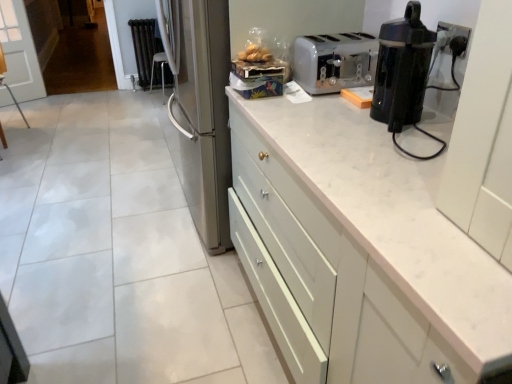
Identify the location of black metallic radiator at upper left. This screenshot has width=512, height=384. (149, 54).

At what (x,y) coordinates should I click in order to perform the action: click on translucent plastic bag of bread at upper center. Please return your answer as a coordinate pair (x, y). The image size is (512, 384). Looking at the image, I should click on (255, 54).

What is the approximate width of white matte cabinet at upper right?

white matte cabinet at upper right is 25.73 inches in width.

Identify the location of black plastic coffee maker at upper right. (402, 69).

Measure the distance between point (360,59) and camera.

Point (360,59) is 1.88 meters away from camera.

Measure the distance between black plastic electric outlet at upper right and camera.

1.26 meters.

In order to face black plastic electric outlet at upper right, should I rotate leftwards or rightwards?

Rotate right and turn 24.347 degrees.

Where is `black metallic radiator at upper left`? The width and height of the screenshot is (512, 384). black metallic radiator at upper left is located at coordinates (149, 54).

Who is shorter, black plastic coffee maker at upper right or white matte cabinet at upper right?

Standing shorter between the two is black plastic coffee maker at upper right.

Is point (410, 75) positioned behind point (484, 298)?

Yes, it is.

How distant is black plastic coffee maker at upper right from white matte cabinet at upper right?

10.03 inches.

Based on their sizes in the image, would you say black plastic coffee maker at upper right is bigger or smaller than white matte cabinet at upper right?

Clearly, black plastic coffee maker at upper right is smaller in size than white matte cabinet at upper right.

Is translucent plastic bag of bread at upper center looking in the opposite direction of black metallic radiator at upper left?

No, black metallic radiator at upper left is not at the back of translucent plastic bag of bread at upper center.

Would you say translucent plastic bag of bread at upper center contains black metallic radiator at upper left?

No, black metallic radiator at upper left is not surrounded by translucent plastic bag of bread at upper center.

In the scene shown: From the image's perspective, is translucent plastic bag of bread at upper center below black metallic radiator at upper left?

Indeed, from the image's perspective, translucent plastic bag of bread at upper center is shown beneath black metallic radiator at upper left.

From a real-world perspective, is translucent plastic bag of bread at upper center above or below black metallic radiator at upper left?

translucent plastic bag of bread at upper center is above black metallic radiator at upper left.

From a real-world perspective, which object stands above the other?

black plastic electric outlet at upper right.

Is white matte cabinet at upper right at the right side of black plastic electric outlet at upper right?

No.

Considering their positions, is white matte cabinet at upper right located in front of or behind black plastic electric outlet at upper right?

In the image, white matte cabinet at upper right appears in front of black plastic electric outlet at upper right.

Who is smaller, white matte cabinet at upper right or black plastic electric outlet at upper right?

black plastic electric outlet at upper right.

Is point (133, 26) closer or farther from the camera than point (449, 39)?

Point (133, 26) is positioned farther from the camera compared to point (449, 39).

Between black metallic radiator at upper left and black plastic electric outlet at upper right, which one has larger width?

With larger width is black metallic radiator at upper left.

Does black metallic radiator at upper left have a greater height compared to black plastic electric outlet at upper right?

Correct, black metallic radiator at upper left is much taller as black plastic electric outlet at upper right.

Is black metallic radiator at upper left oriented towards black plastic electric outlet at upper right?

Yes, black metallic radiator at upper left is aimed at black plastic electric outlet at upper right.

You are a GUI agent. You are given a task and a screenshot of the screen. Output one action in this format:
    pyautogui.click(x=<x>, y=<y>)
    Task: Click on the electric outlet below the translucent plastic bag of bread at upper center (from the image's perspective)
    
    Given the screenshot: What is the action you would take?
    pyautogui.click(x=454, y=30)

Which object is positioned more to the left, black plastic electric outlet at upper right or translucent plastic bag of bread at upper center?

From the viewer's perspective, translucent plastic bag of bread at upper center appears more on the left side.

Could you tell me if black plastic electric outlet at upper right is facing translucent plastic bag of bread at upper center?

No, black plastic electric outlet at upper right does not turn towards translucent plastic bag of bread at upper center.

Considering the sizes of objects black plastic electric outlet at upper right and translucent plastic bag of bread at upper center in the image provided, who is thinner, black plastic electric outlet at upper right or translucent plastic bag of bread at upper center?

With smaller width is black plastic electric outlet at upper right.

Is black plastic electric outlet at upper right at the right side of black plastic coffee maker at upper right?

Yes.

Can we say black plastic electric outlet at upper right lies outside black plastic coffee maker at upper right?

Yes, black plastic electric outlet at upper right is not within black plastic coffee maker at upper right.

Is black plastic electric outlet at upper right wider or thinner than black plastic coffee maker at upper right?

Clearly, black plastic electric outlet at upper right has less width compared to black plastic coffee maker at upper right.

Could you tell me if black plastic coffee maker at upper right is turned towards white plastic toaster at upper right?

No, black plastic coffee maker at upper right does not turn towards white plastic toaster at upper right.

From the image's perspective, is black plastic coffee maker at upper right above white plastic toaster at upper right?

No, from the image's perspective, black plastic coffee maker at upper right is not on top of white plastic toaster at upper right.

Which object is further away from the camera, black plastic coffee maker at upper right or white plastic toaster at upper right?

white plastic toaster at upper right is behind.

Is black plastic coffee maker at upper right far away from white plastic toaster at upper right?

No, there isn't a large distance between black plastic coffee maker at upper right and white plastic toaster at upper right.

The width and height of the screenshot is (512, 384). In the image, there is a black plastic coffee maker at upper right. Identify the location of cabinetry below it (from the image's perspective). (393, 218).

This screenshot has height=384, width=512. What are the coordinates of `radiator on the left of translucent plastic bag of bread at upper center` in the screenshot? It's located at (149, 54).

Consider the image. Which object lies further to the anchor point translucent plastic bag of bread at upper center, white matte cabinet at upper right or black plastic electric outlet at upper right?

white matte cabinet at upper right.

Estimate the real-world distances between objects in this image. Which object is further from translucent plastic bag of bread at upper center, black plastic electric outlet at upper right or white matte cabinet at upper right?

The object further to translucent plastic bag of bread at upper center is white matte cabinet at upper right.

When comparing their distances from translucent plastic bag of bread at upper center, does black metallic radiator at upper left or black plastic electric outlet at upper right seem closer?

Based on the image, black plastic electric outlet at upper right appears to be nearer to translucent plastic bag of bread at upper center.

From the image, which object appears to be nearer to white matte cabinet at upper right, white plastic toaster at upper right or translucent plastic bag of bread at upper center?

white plastic toaster at upper right is closer to white matte cabinet at upper right.

Estimate the real-world distances between objects in this image. Which object is closer to black metallic radiator at upper left, white matte cabinet at upper right or white plastic toaster at upper right?

white plastic toaster at upper right lies closer to black metallic radiator at upper left than the other object.

Which object lies nearer to the anchor point white plastic toaster at upper right, translucent plastic bag of bread at upper center or white matte cabinet at upper right?

translucent plastic bag of bread at upper center is positioned closer to the anchor white plastic toaster at upper right.

Which object lies further to the anchor point black metallic radiator at upper left, black plastic electric outlet at upper right or black plastic coffee maker at upper right?

black plastic electric outlet at upper right.

Based on their spatial positions, is black plastic electric outlet at upper right or black plastic coffee maker at upper right closer to white plastic toaster at upper right?

The object closer to white plastic toaster at upper right is black plastic coffee maker at upper right.

Where is `home appliance between translucent plastic bag of bread at upper center and black plastic electric outlet at upper right from left to right`? The image size is (512, 384). home appliance between translucent plastic bag of bread at upper center and black plastic electric outlet at upper right from left to right is located at coordinates (402, 69).

The height and width of the screenshot is (384, 512). Find the location of `electric outlet between black plastic coffee maker at upper right and white plastic toaster at upper right in the front-back direction`. electric outlet between black plastic coffee maker at upper right and white plastic toaster at upper right in the front-back direction is located at coordinates (454, 30).

Where is `electric outlet between white matte cabinet at upper right and translucent plastic bag of bread at upper center along the z-axis`? electric outlet between white matte cabinet at upper right and translucent plastic bag of bread at upper center along the z-axis is located at coordinates (454, 30).

Find the location of a particular element. The height and width of the screenshot is (384, 512). kitchen appliance between white matte cabinet at upper right and black metallic radiator at upper left along the z-axis is located at coordinates (334, 61).